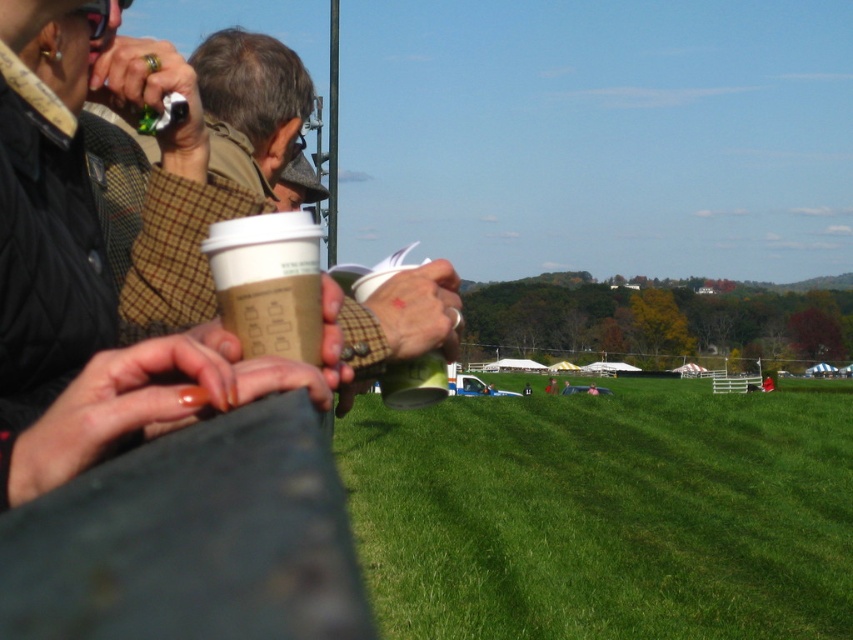
Question: Among these objects, which one is farthest from the camera?

Choices:
 (A) green grass at center
 (B) matte brown paper cup at center

Answer: (A)

Question: Is green grass at center positioned before matte brown paper cup at center?

Choices:
 (A) yes
 (B) no

Answer: (B)

Question: Does green grass at center appear on the left side of matte brown paper cup at center?

Choices:
 (A) yes
 (B) no

Answer: (B)

Question: Is green grass at center further to camera compared to matte brown paper cup at center?

Choices:
 (A) yes
 (B) no

Answer: (A)

Question: Which object is farther from the camera taking this photo?

Choices:
 (A) matte brown paper cup at center
 (B) green grass at center

Answer: (B)